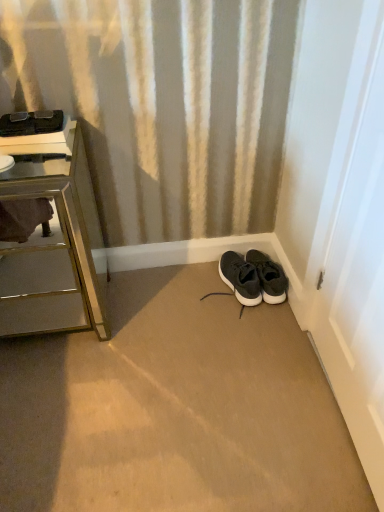
Question: Is metallic mirrored chest of drawers at left closer to camera compared to matte black sneaker at lower right?

Choices:
 (A) no
 (B) yes

Answer: (B)

Question: Could you tell me if metallic mirrored chest of drawers at left is turned towards matte black sneaker at lower right?

Choices:
 (A) no
 (B) yes

Answer: (A)

Question: Considering the relative positions of metallic mirrored chest of drawers at left and matte black sneaker at lower right in the image provided, is metallic mirrored chest of drawers at left to the left of matte black sneaker at lower right from the viewer's perspective?

Choices:
 (A) yes
 (B) no

Answer: (A)

Question: Is metallic mirrored chest of drawers at left oriented away from matte black sneaker at lower right?

Choices:
 (A) no
 (B) yes

Answer: (A)

Question: Is metallic mirrored chest of drawers at left next to matte black sneaker at lower right?

Choices:
 (A) yes
 (B) no

Answer: (B)

Question: From a real-world perspective, is black matte sneakers at lower right physically located above or below white glossy door at right?

Choices:
 (A) above
 (B) below

Answer: (B)

Question: Is black matte sneakers at lower right inside or outside of white glossy door at right?

Choices:
 (A) outside
 (B) inside

Answer: (A)

Question: Considering the positions of point (284, 294) and point (339, 244), is point (284, 294) closer or farther from the camera than point (339, 244)?

Choices:
 (A) closer
 (B) farther

Answer: (B)

Question: Is black matte sneakers at lower right taller or shorter than white glossy door at right?

Choices:
 (A) short
 (B) tall

Answer: (A)

Question: From their relative heights in the image, would you say white glossy door at right is taller or shorter than metallic mirrored chest of drawers at left?

Choices:
 (A) short
 (B) tall

Answer: (B)

Question: In the image, is white glossy door at right positioned in front of or behind metallic mirrored chest of drawers at left?

Choices:
 (A) front
 (B) behind

Answer: (A)

Question: Does point (340, 291) appear closer or farther from the camera than point (71, 143)?

Choices:
 (A) farther
 (B) closer

Answer: (B)

Question: In terms of size, does white glossy door at right appear bigger or smaller than metallic mirrored chest of drawers at left?

Choices:
 (A) big
 (B) small

Answer: (B)

Question: Is metallic mirrored chest of drawers at left inside the boundaries of white glossy door at right, or outside?

Choices:
 (A) outside
 (B) inside

Answer: (A)

Question: Is metallic mirrored chest of drawers at left taller or shorter than white glossy door at right?

Choices:
 (A) short
 (B) tall

Answer: (A)